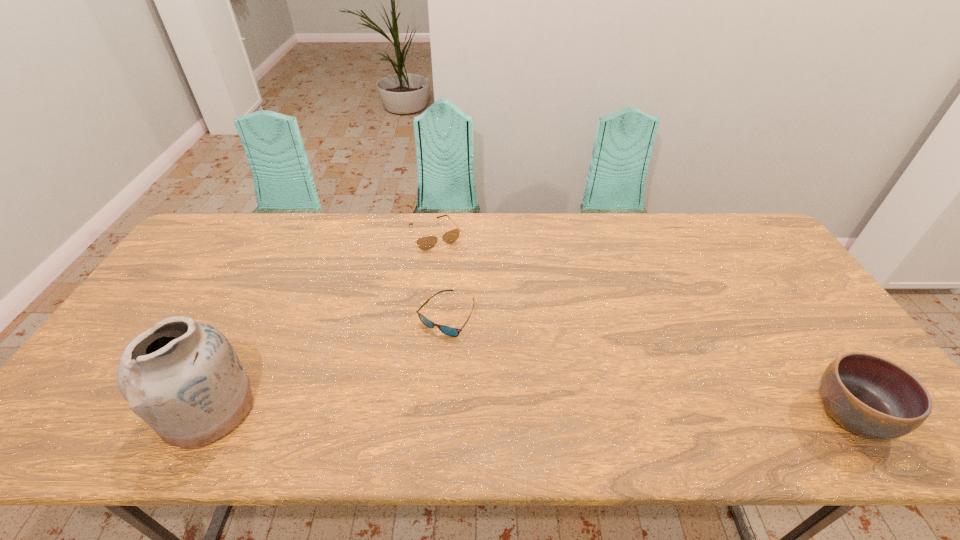
Locate an element on the screen. The height and width of the screenshot is (540, 960). vacant space at the far edge of the desktop is located at coordinates (287, 234).

Find the location of `free location at the near edge of the desktop`. free location at the near edge of the desktop is located at coordinates (781, 394).

Locate an element on the screen. blank space at the left edge of the desktop is located at coordinates pyautogui.click(x=156, y=306).

In order to click on vacant region at the right edge in this screenshot , I will do pyautogui.click(x=821, y=359).

Where is `vacant region at the far right corner of the desktop`? The width and height of the screenshot is (960, 540). vacant region at the far right corner of the desktop is located at coordinates (756, 232).

Where is `vacant area between the rightmost object and the taller sunglasses`? vacant area between the rightmost object and the taller sunglasses is located at coordinates (643, 325).

Locate an element on the screen. The height and width of the screenshot is (540, 960). free space between the rightmost object and the taller sunglasses is located at coordinates (643, 325).

I want to click on vacant space in between the leftmost object and the nearer sunglasses, so click(327, 362).

The height and width of the screenshot is (540, 960). What are the coordinates of `vacant space that is in between the farther sunglasses and the leftmost object` in the screenshot? It's located at (322, 321).

The image size is (960, 540). Find the location of `unoccupied area between the second tallest object and the leftmost object`. unoccupied area between the second tallest object and the leftmost object is located at coordinates (530, 411).